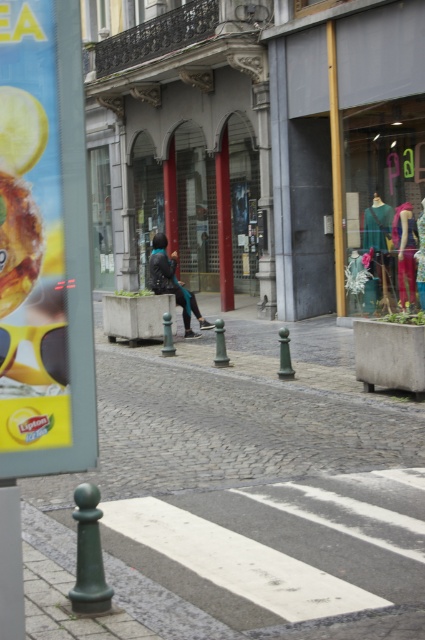
Which is behind, point (39, 140) or point (402, 268)?

Point (402, 268)

Does point (28, 346) lie behind point (402, 280)?

No.

The height and width of the screenshot is (640, 425). In order to click on yellow plastic sign at left in this screenshot , I will do `click(31, 234)`.

Does cobblestone pavement at center appear on the right side of matte black jacket at center?

Correct, you'll find cobblestone pavement at center to the right of matte black jacket at center.

Who is positioned more to the left, cobblestone pavement at center or matte black jacket at center?

matte black jacket at center is more to the left.

Which is behind, point (102, 544) or point (187, 333)?

Point (187, 333)

You are a GUI agent. You are given a task and a screenshot of the screen. Output one action in this format:
    pyautogui.click(x=<x>, y=<y>)
    Task: Click on the cobblestone pavement at center
    This screenshot has height=640, width=425.
    Given the screenshot: What is the action you would take?
    pyautogui.click(x=241, y=497)

Does matte black jacket at center have a greater height compared to multicolored fabric dress at center right?

Correct, matte black jacket at center is much taller as multicolored fabric dress at center right.

Between point (153, 237) and point (399, 234), which one is positioned behind?

Point (153, 237)

The height and width of the screenshot is (640, 425). In order to click on matte black jacket at center in this screenshot , I will do `click(172, 284)`.